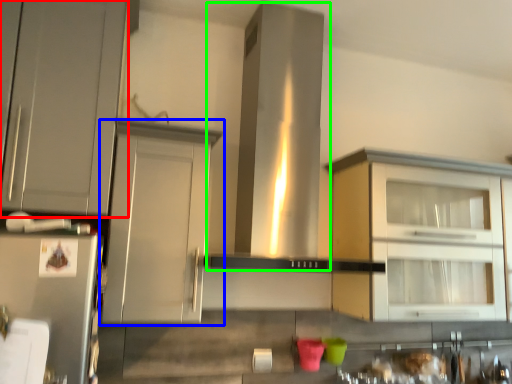
Question: Considering the real-world distances, which object is farthest from cabinetry (highlighted by a red box)? cabinetry (highlighted by a blue box) or vent (highlighted by a green box)?

Choices:
 (A) cabinetry
 (B) vent

Answer: (B)